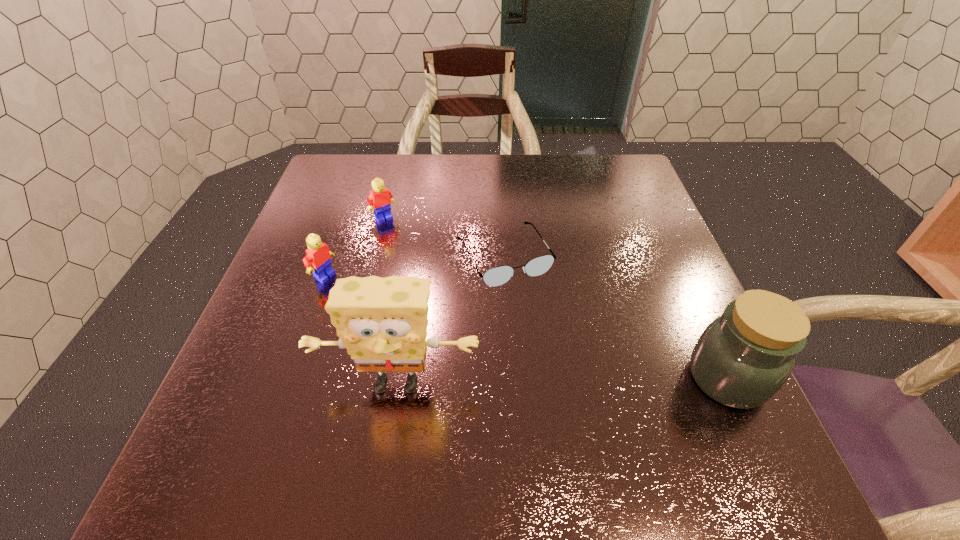
Locate an element on the screen. The width and height of the screenshot is (960, 540). the tallest object is located at coordinates (382, 322).

Identify the location of the second tallest object. The image size is (960, 540). (741, 360).

The height and width of the screenshot is (540, 960). Find the location of `the rightmost object`. the rightmost object is located at coordinates (741, 360).

Image resolution: width=960 pixels, height=540 pixels. Find the location of `the nearer Lego`. the nearer Lego is located at coordinates (318, 256).

Where is `the leftmost object`? This screenshot has height=540, width=960. the leftmost object is located at coordinates (318, 256).

The image size is (960, 540). What are the coordinates of `the right Lego` in the screenshot? It's located at (380, 198).

The width and height of the screenshot is (960, 540). What are the coordinates of `the farther Lego` in the screenshot? It's located at point(380,198).

The height and width of the screenshot is (540, 960). In order to click on the shortest object in this screenshot , I will do [x=497, y=276].

Where is `vacant space located on the left of the jar`? vacant space located on the left of the jar is located at coordinates (588, 378).

At what (x,y) coordinates should I click in order to perform the action: click on vacant area located on the front-facing side of the nearer Lego. Please return your answer as a coordinate pair (x, y). The height and width of the screenshot is (540, 960). Looking at the image, I should click on (441, 336).